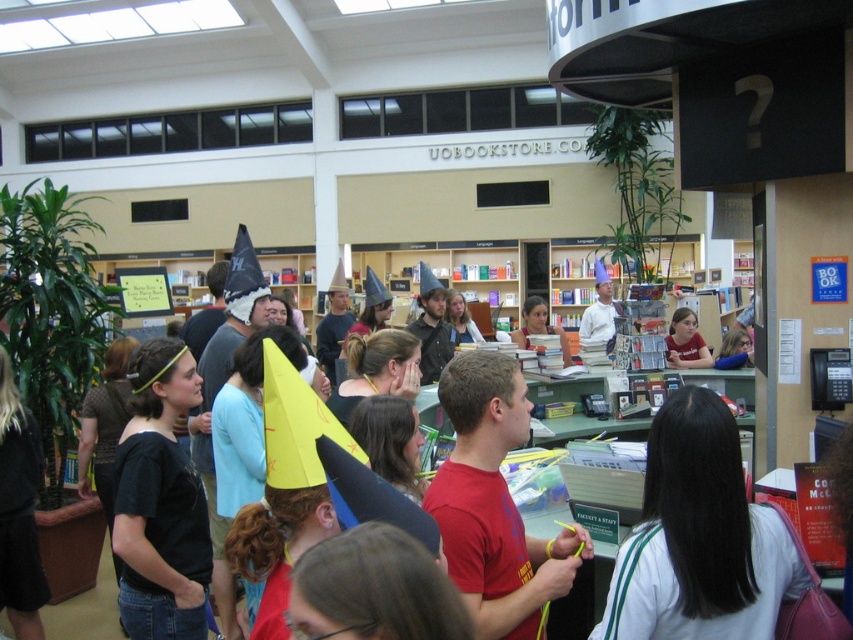
Question: Which object appears farthest from the camera in this image?

Choices:
 (A) red matte shirt at center
 (B) white matte shirt at center

Answer: (A)

Question: Among these objects, which one is farthest from the camera?

Choices:
 (A) white matte shirt at center
 (B) red matte shirt at center

Answer: (B)

Question: Which point is closer to the camera?

Choices:
 (A) white matte shirt at center
 (B) matte blue shirt at center

Answer: (A)

Question: Is red matte shirt at center thinner than matte blue shirt at center?

Choices:
 (A) no
 (B) yes

Answer: (B)

Question: Can you confirm if white matte shirt at center is positioned to the right of red matte shirt at center?

Choices:
 (A) no
 (B) yes

Answer: (B)

Question: Does white matte shirt at center appear over red matte shirt at center?

Choices:
 (A) yes
 (B) no

Answer: (B)